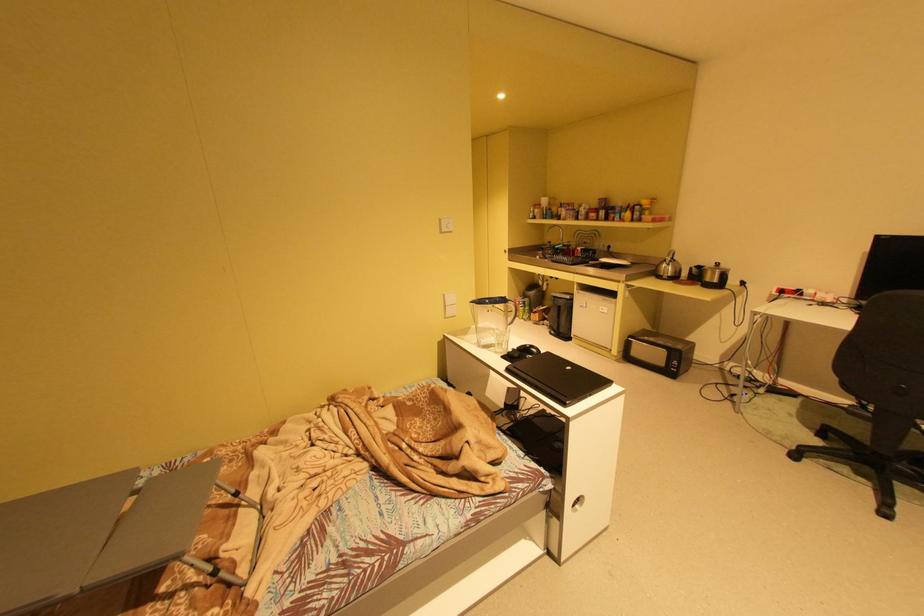
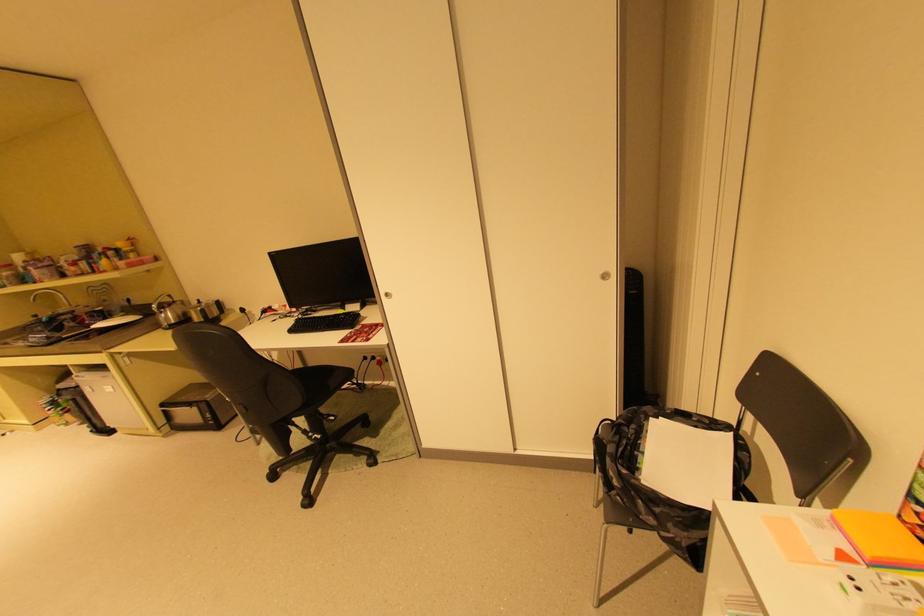
In the second image, find the point that corresponds to (x=684, y=272) in the first image.

(187, 317)